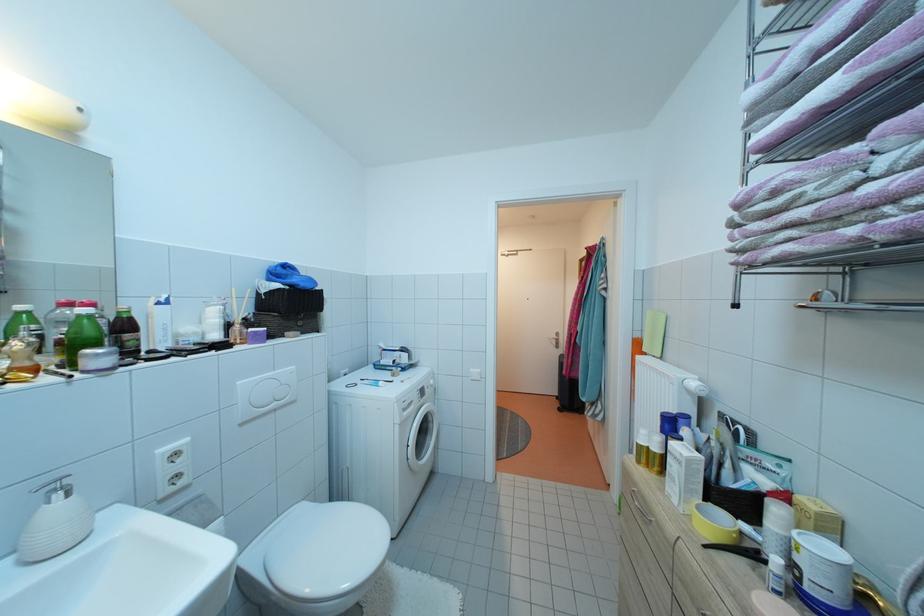
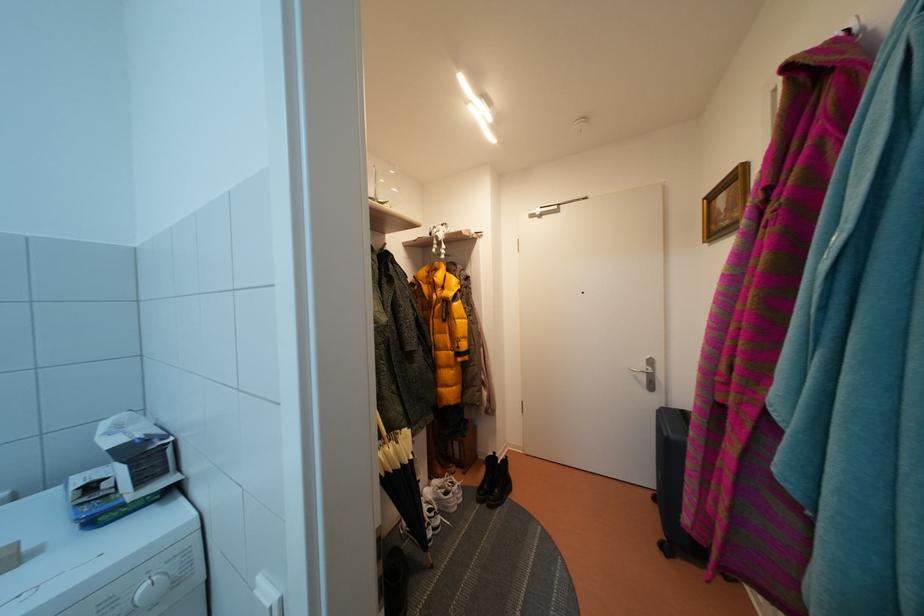
Which direction would the cameraman need to move to produce the second image?

The movement direction of the cameraman is right, forward.